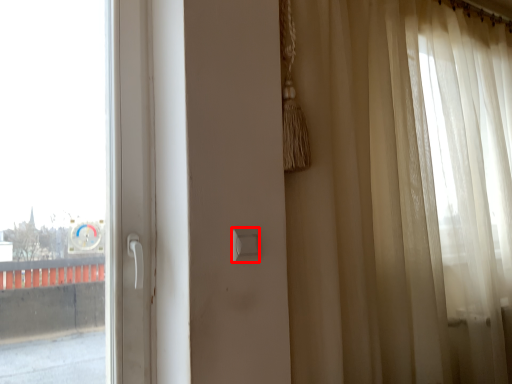
Question: From the image's perspective, what is the correct spatial positioning of light switch (annotated by the red box) in reference to curtain?

Choices:
 (A) above
 (B) below

Answer: (B)